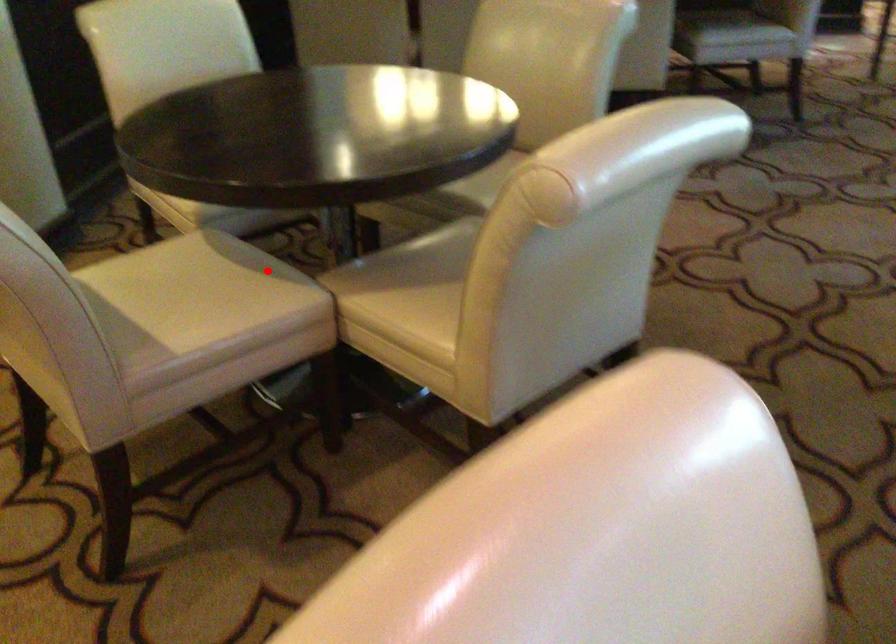
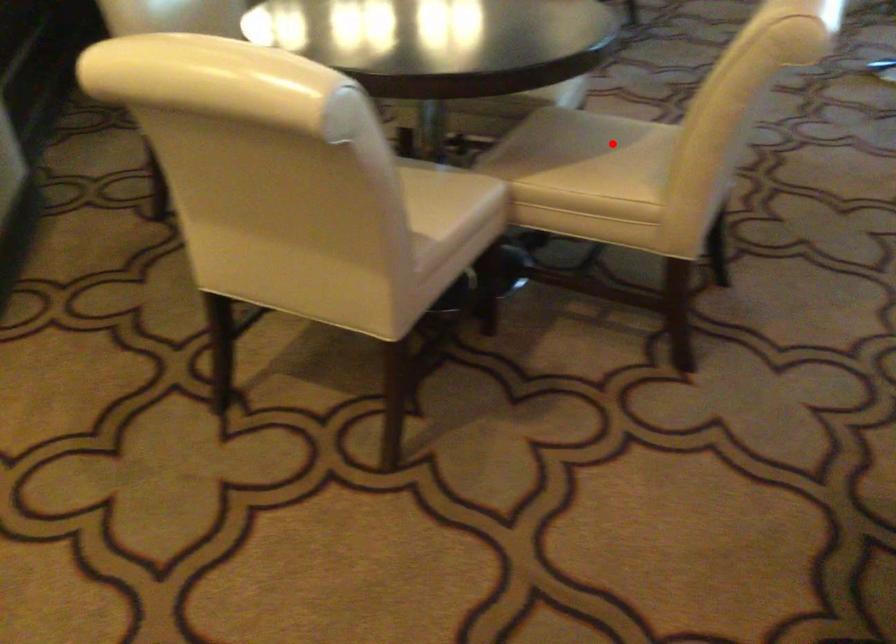
I am providing you with two images of the same scene from different viewpoints. A red point is marked on the first image and another point is marked on the second image. Are the points marked in image1 and image2 representing the same 3D position?

No